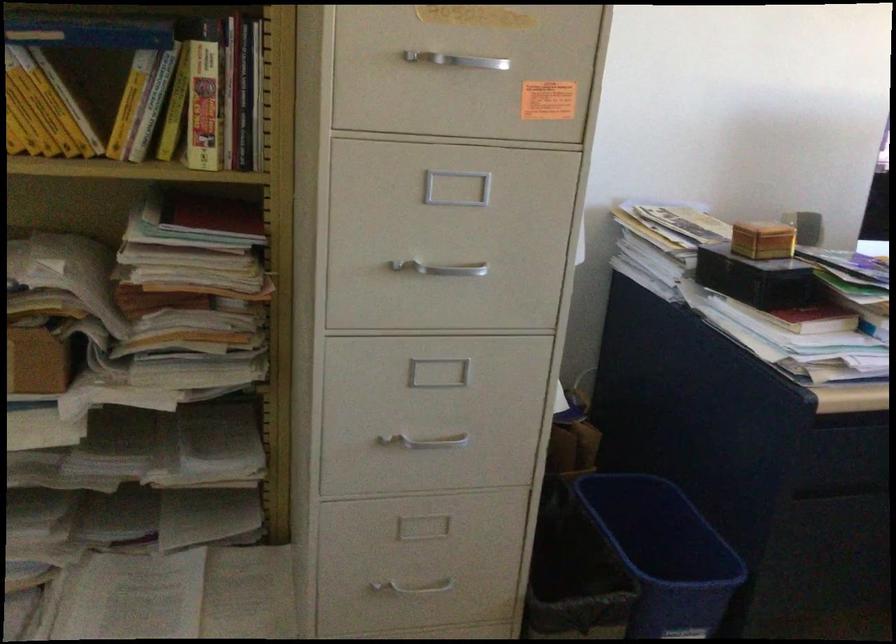
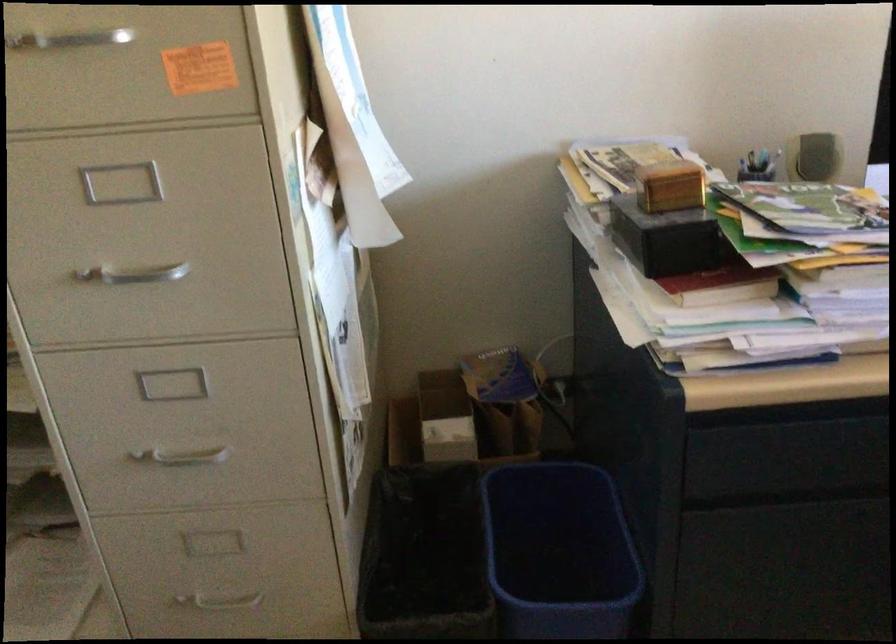
Locate, in the second image, the point that corresponds to point (769, 238) in the first image.

(669, 185)